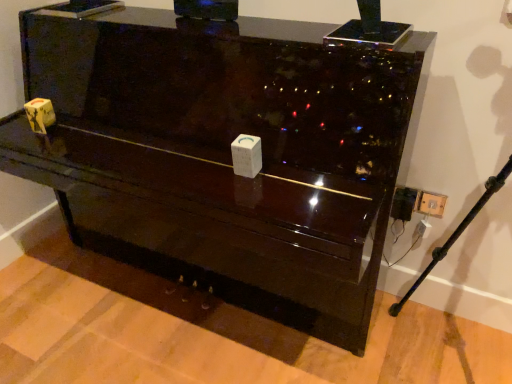
The image size is (512, 384). I want to click on yellow plastic electric outlet at lower right, so click(430, 204).

This screenshot has height=384, width=512. What do you see at coordinates (430, 204) in the screenshot?
I see `yellow plastic electric outlet at lower right` at bounding box center [430, 204].

This screenshot has width=512, height=384. What are the coordinates of `yellow plastic electric outlet at lower right` in the screenshot? It's located at (430, 204).